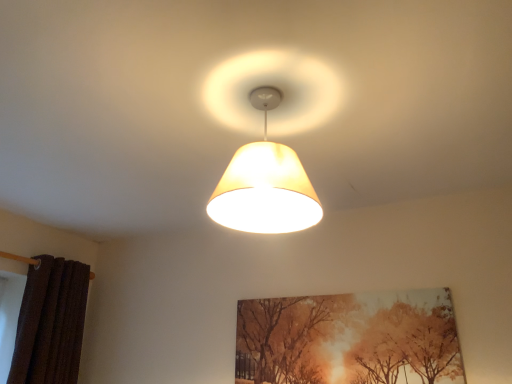
What is the approximate height of matte beige lampshade at center?

matte beige lampshade at center is 38.12 centimeters in height.

Where is `matte canvas painting at center`? The height and width of the screenshot is (384, 512). matte canvas painting at center is located at coordinates (349, 339).

Image resolution: width=512 pixels, height=384 pixels. What do you see at coordinates (50, 323) in the screenshot?
I see `brown textured curtain at left` at bounding box center [50, 323].

Measure the distance between point (56, 272) and camera.

7.68 feet.

The image size is (512, 384). Identify the location of matte beige lampshade at center. (265, 183).

From the image's perspective, which one is positioned lower, brown textured curtain at left or matte beige lampshade at center?

brown textured curtain at left, from the image's perspective.

In the scene shown: How different are the orientations of brown textured curtain at left and matte beige lampshade at center in degrees?

There is a 85.7-degree angle between the facing directions of brown textured curtain at left and matte beige lampshade at center.

Can you confirm if brown textured curtain at left is positioned to the left of matte beige lampshade at center?

Yes, brown textured curtain at left is to the left of matte beige lampshade at center.

Does brown textured curtain at left have a larger size compared to matte beige lampshade at center?

Indeed, brown textured curtain at left has a larger size compared to matte beige lampshade at center.

Which is behind, point (327, 372) or point (241, 149)?

The point (327, 372) is farther from the camera.

Does matte canvas painting at center have a greater width compared to matte beige lampshade at center?

In fact, matte canvas painting at center might be narrower than matte beige lampshade at center.

What's the angular difference between matte canvas painting at center and matte beige lampshade at center's facing directions?

4.1 degrees.

Is matte canvas painting at center smaller than matte beige lampshade at center?

Yes, matte canvas painting at center is smaller than matte beige lampshade at center.

What's the angular difference between brown textured curtain at left and matte canvas painting at center's facing directions?

The angle between the facing direction of brown textured curtain at left and the facing direction of matte canvas painting at center is 89.8 degrees.

Between brown textured curtain at left and matte canvas painting at center, which one appears on the left side from the viewer's perspective?

brown textured curtain at left is more to the left.

Does brown textured curtain at left lie in front of matte canvas painting at center?

No, it is behind matte canvas painting at center.

Does brown textured curtain at left turn towards matte canvas painting at center?

Yes, brown textured curtain at left is turned towards matte canvas painting at center.

Is matte beige lampshade at center beside matte canvas painting at center?

No, matte beige lampshade at center is not next to matte canvas painting at center.

Is matte beige lampshade at center inside or outside of matte canvas painting at center?

matte beige lampshade at center lies outside matte canvas painting at center.

From a real-world perspective, between matte beige lampshade at center and matte canvas painting at center, who is vertically lower?

From a 3D spatial view, matte canvas painting at center is below.

Is matte beige lampshade at center aimed at matte canvas painting at center?

No, matte beige lampshade at center is not oriented towards matte canvas painting at center.

In the image, is matte canvas painting at center positioned in front of or behind brown textured curtain at left?

In the image, matte canvas painting at center appears in front of brown textured curtain at left.

From the image's perspective, which object appears higher, matte canvas painting at center or brown textured curtain at left?

matte canvas painting at center appears higher in the image.

Between matte canvas painting at center and brown textured curtain at left, which one has smaller width?

matte canvas painting at center.

Which point is more distant from viewer, [436,333] or [63,286]?

Positioned behind is point [63,286].

Are matte beige lampshade at center and brown textured curtain at left beside each other?

No, matte beige lampshade at center is not next to brown textured curtain at left.

Can you confirm if matte beige lampshade at center is taller than brown textured curtain at left?

Incorrect, the height of matte beige lampshade at center is not larger of that of brown textured curtain at left.

Does point (241, 229) come behind point (50, 373)?

No, it is in front of (50, 373).

You are a GUI agent. You are given a task and a screenshot of the screen. Output one action in this format:
    pyautogui.click(x=<x>, y=<y>)
    Task: Click on the curtain below the matte beige lampshade at center (from the image's perspective)
    
    Given the screenshot: What is the action you would take?
    pyautogui.click(x=50, y=323)

Where is `picture frame behind the matte beige lampshade at center`? The width and height of the screenshot is (512, 384). picture frame behind the matte beige lampshade at center is located at coordinates (349, 339).

Based on their spatial positions, is brown textured curtain at left or matte beige lampshade at center closer to matte canvas painting at center?

The object closer to matte canvas painting at center is matte beige lampshade at center.

When comparing their distances from brown textured curtain at left, does matte beige lampshade at center or matte canvas painting at center seem further?

matte beige lampshade at center is positioned further to the anchor brown textured curtain at left.

Based on their spatial positions, is matte canvas painting at center or matte beige lampshade at center further from brown textured curtain at left?

Based on the image, matte beige lampshade at center appears to be further to brown textured curtain at left.

From the image, which object appears to be farther from matte canvas painting at center, matte beige lampshade at center or brown textured curtain at left?

brown textured curtain at left is further to matte canvas painting at center.

Considering their positions, is matte canvas painting at center positioned closer to matte beige lampshade at center than brown textured curtain at left?

matte canvas painting at center is positioned closer to the anchor matte beige lampshade at center.

When comparing their distances from matte beige lampshade at center, does brown textured curtain at left or matte canvas painting at center seem closer?

matte canvas painting at center lies closer to matte beige lampshade at center than the other object.

You are a GUI agent. You are given a task and a screenshot of the screen. Output one action in this format:
    pyautogui.click(x=<x>, y=<y>)
    Task: Click on the lamp between brown textured curtain at left and matte canvas painting at center
    The height and width of the screenshot is (384, 512).
    Given the screenshot: What is the action you would take?
    pyautogui.click(x=265, y=183)